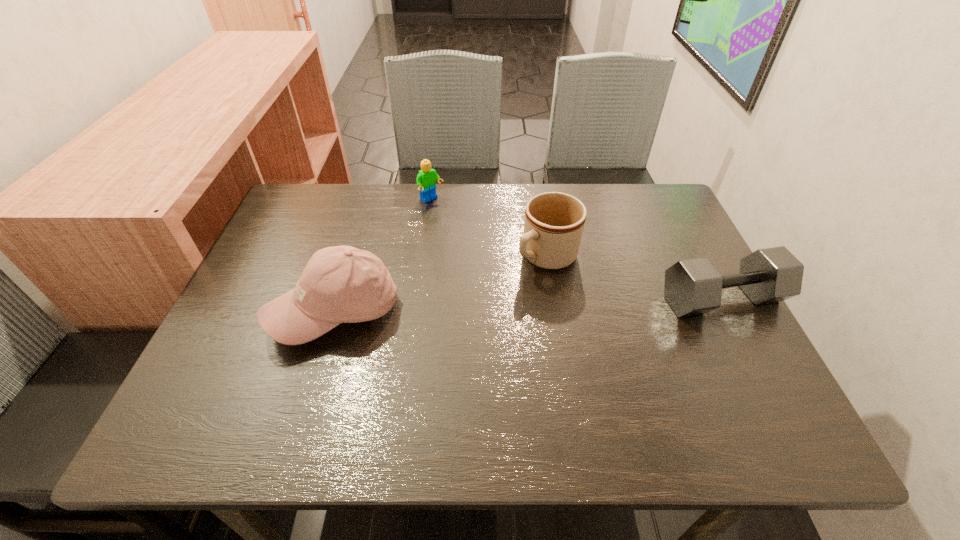
The image size is (960, 540). I want to click on vacant area located 0.210m on the face of the Lego, so click(481, 243).

In order to click on vacant area located 0.140m on the face of the Lego in this screenshot , I will do `click(466, 230)`.

Image resolution: width=960 pixels, height=540 pixels. I want to click on object that is at the far edge, so click(x=426, y=179).

Find the location of a particular element. object at the left edge is located at coordinates (342, 284).

Where is `object that is at the right edge`? object that is at the right edge is located at coordinates (692, 287).

Image resolution: width=960 pixels, height=540 pixels. In the image, there is a desktop. In order to click on vacant area at the far edge in this screenshot , I will do `click(411, 187)`.

What are the coordinates of `free space at the near edge` in the screenshot? It's located at (337, 381).

Find the location of a particular element. vacant space at the left edge of the desktop is located at coordinates (252, 323).

In order to click on vacant point at the right edge in this screenshot , I will do `click(695, 347)`.

At what (x,y) coordinates should I click in order to perform the action: click on free space at the far left corner of the desktop. Please return your answer as a coordinate pair (x, y). This screenshot has width=960, height=540. Looking at the image, I should click on (334, 199).